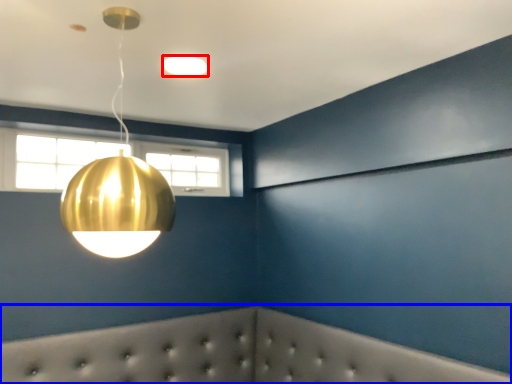
Question: Among these objects, which one is nearest to the camera, lamp (highlighted by a red box) or furniture (highlighted by a blue box)?

Choices:
 (A) lamp
 (B) furniture

Answer: (B)